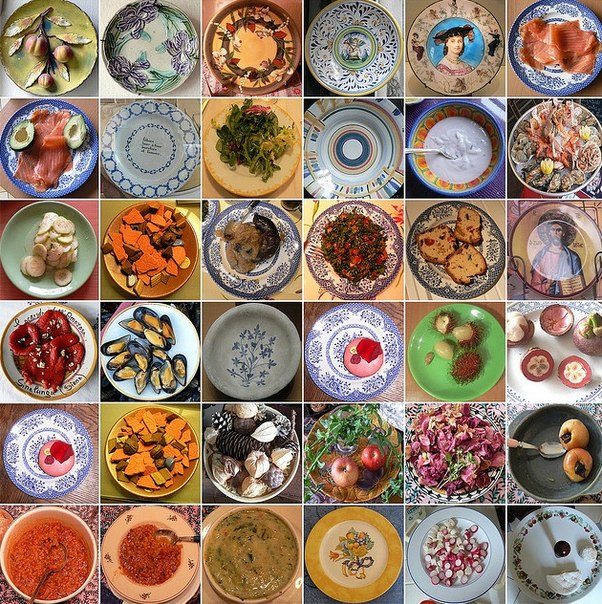
In order to click on spoons in this screenshot , I will do `click(29, 590)`, `click(184, 539)`, `click(526, 442)`, `click(415, 153)`.